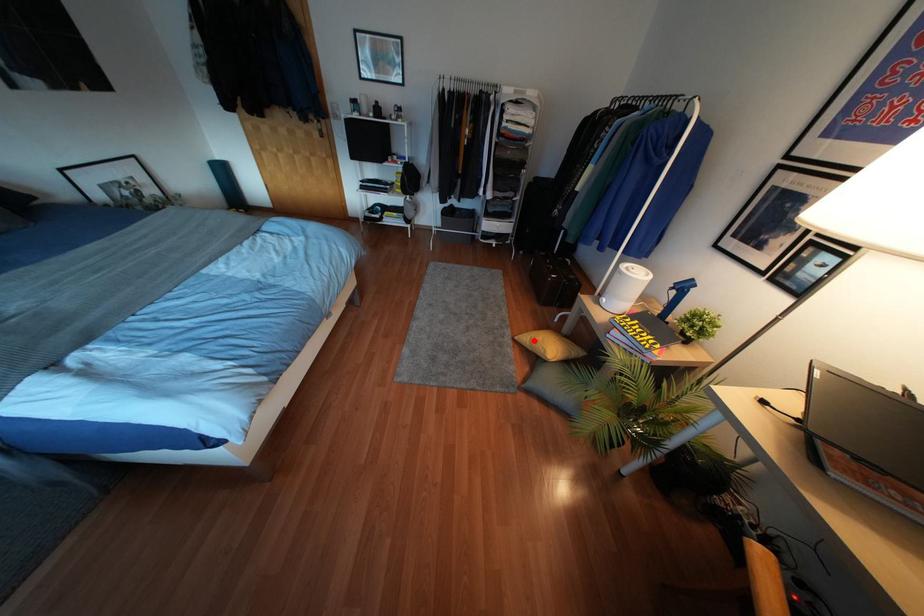
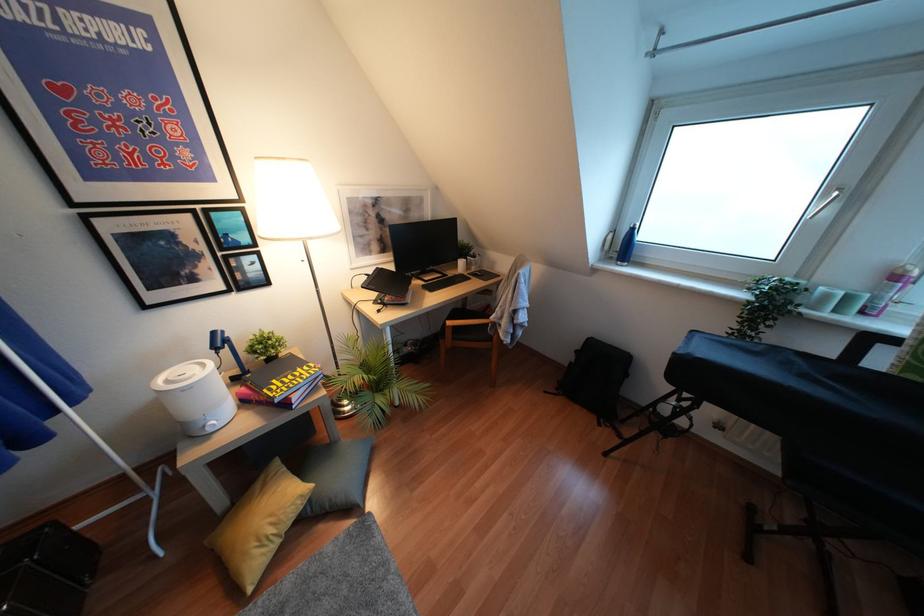
Locate, in the second image, the point that corresponds to the highlighted location in the first image.

(271, 530)